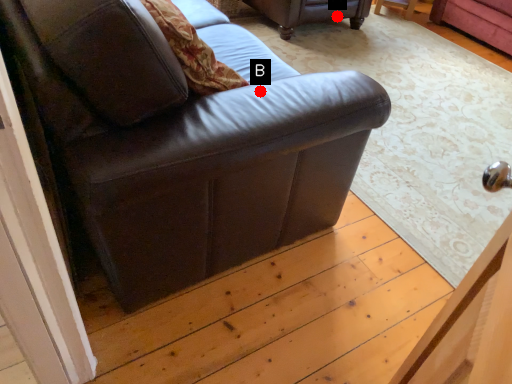
Question: Two points are circled on the image, labeled by A and B beside each circle. Among these points, which one is nearest to the camera?

Choices:
 (A) A is closer
 (B) B is closer

Answer: (B)